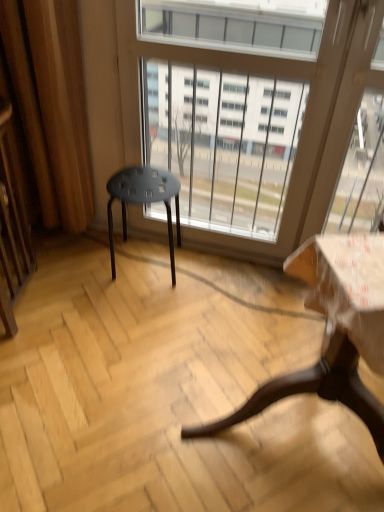
Question: Is point (329, 151) positioned closer to the camera than point (117, 185)?

Choices:
 (A) closer
 (B) farther

Answer: (A)

Question: Considering the relative positions of transparent glass window at center and matte black stool at center in the image provided, is transparent glass window at center to the left or to the right of matte black stool at center?

Choices:
 (A) right
 (B) left

Answer: (A)

Question: Estimate the real-world distances between objects in this image. Which object is farther from the matte black stool at center?

Choices:
 (A) wooden screen door at left
 (B) wooden table at lower right
 (C) transparent glass window at center

Answer: (B)

Question: Estimate the real-world distances between objects in this image. Which object is closer to the matte black stool at center?

Choices:
 (A) wooden table at lower right
 (B) wooden screen door at left
 (C) transparent glass window at center

Answer: (C)